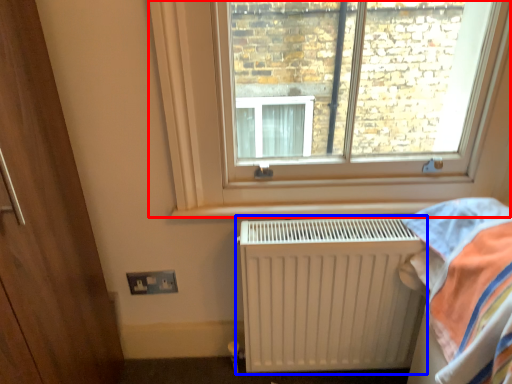
Question: Which point is further to the camera, window (highlighted by a red box) or radiator (highlighted by a blue box)?

Choices:
 (A) window
 (B) radiator

Answer: (B)